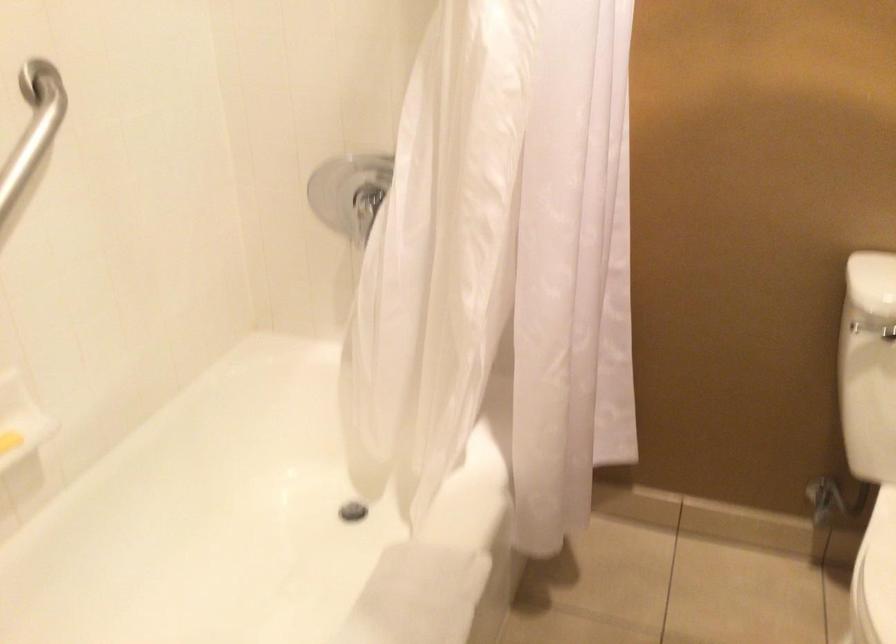
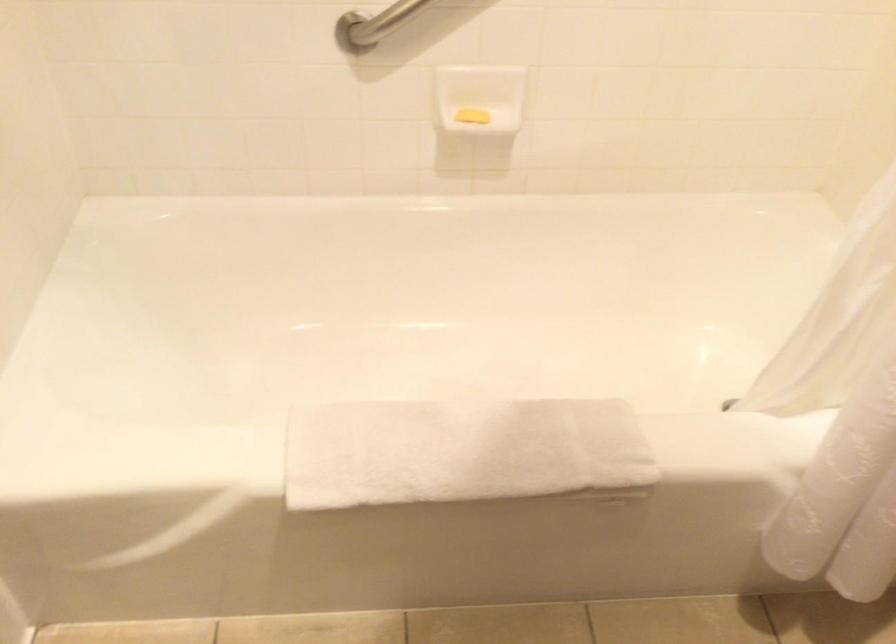
First-person continuous shooting, in which direction is the camera rotating?

The rotation direction of the camera is left-down.